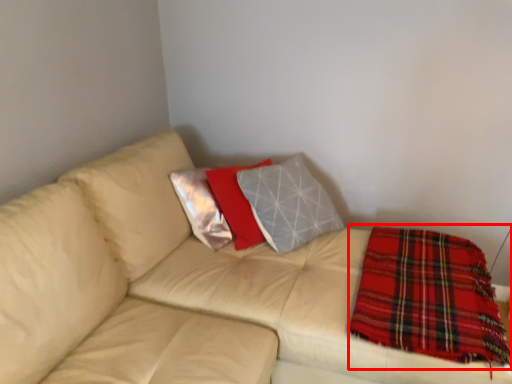
Question: From the image's perspective, where is blanket (annotated by the red box) located relative to studio couch?

Choices:
 (A) below
 (B) above

Answer: (A)